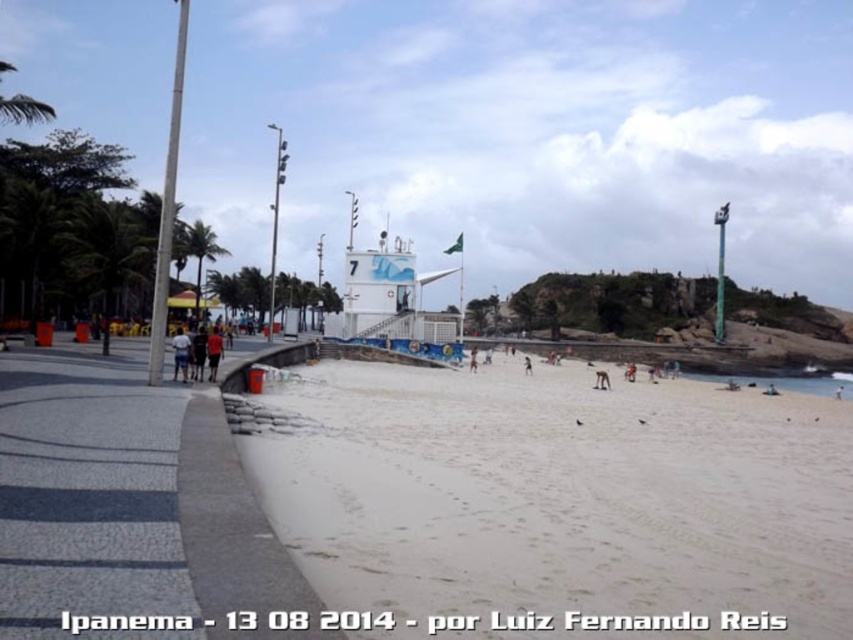
Can you confirm if brown leather sandal at lower center is wider than dark skin human at center?

Incorrect, brown leather sandal at lower center's width does not surpass dark skin human at center's.

Is point (606, 372) closer to viewer compared to point (529, 372)?

Yes.

Who is more distant from viewer, (601, 385) or (523, 364)?

Point (523, 364)

Locate an element on the screen. Image resolution: width=853 pixels, height=640 pixels. brown leather sandal at lower center is located at coordinates (601, 380).

Between green leafy palm tree at left and light brown sand at center, which one is positioned higher?

green leafy palm tree at left is above.

Does green leafy palm tree at left have a greater width compared to light brown sand at center?

Indeed, green leafy palm tree at left has a greater width compared to light brown sand at center.

Is point (79, 243) behind point (468, 369)?

That is False.

Image resolution: width=853 pixels, height=640 pixels. What are the coordinates of `green leafy palm tree at left` in the screenshot? It's located at (108, 253).

Between green leafy palm tree at left and dark red shirt at center, which one is positioned lower?

dark red shirt at center

Does point (86, 209) come farther from viewer compared to point (212, 340)?

That is True.

Which is behind, point (154, 236) or point (209, 337)?

The point (154, 236) is more distant.

Where is `green leafy palm tree at left`? green leafy palm tree at left is located at coordinates (108, 253).